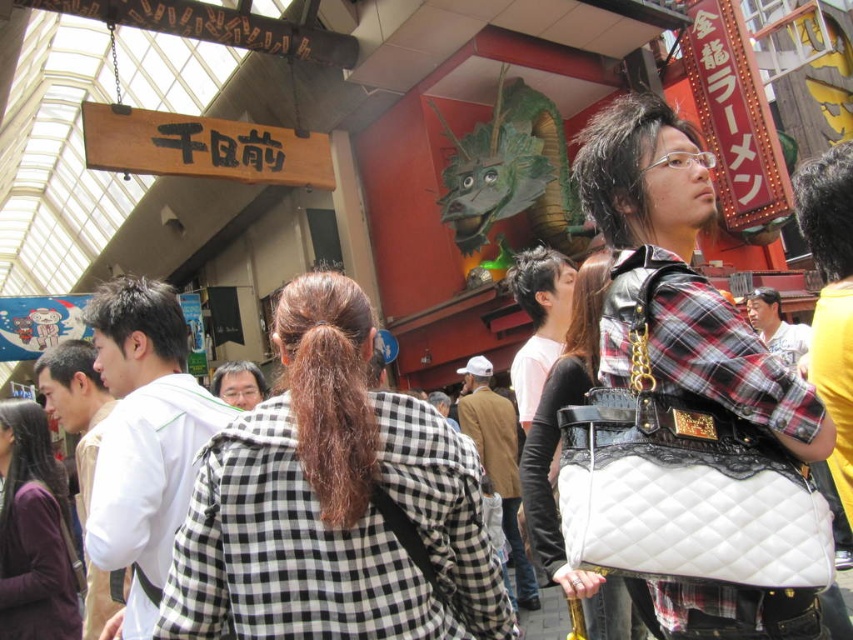
You are a fashion designer observing the scene. You notice two items at the center of the image. Which item is taller, the white quilted leather handbag at center or the dark purple sweater at center?

The white quilted leather handbag at center is taller than the dark purple sweater at center according to the description.